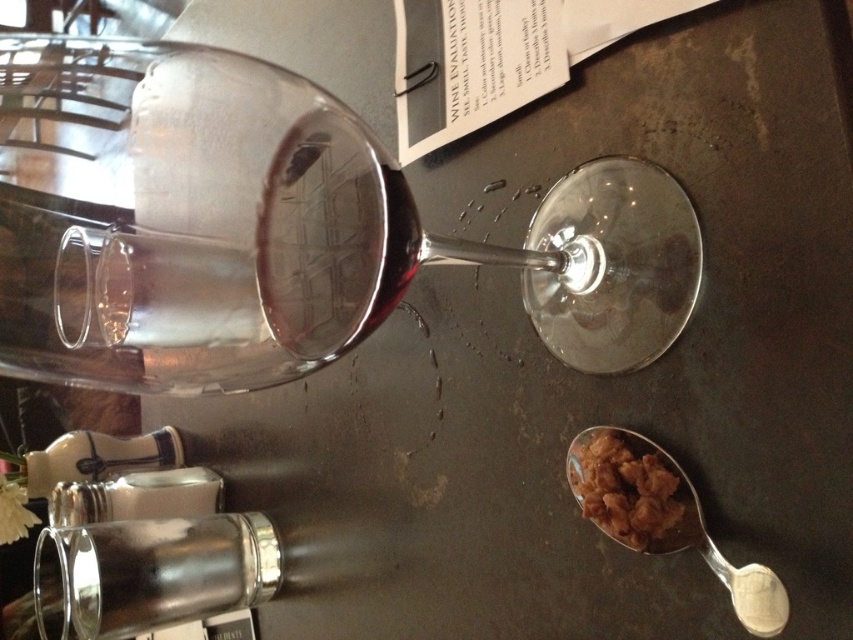
You are at a wine tasting event and see a table setup. There is a partially filled wine glass at the left side of the frame and a point marked at coordinates (x=276, y=228). Based on the table setup, where is the transparent glass located in relation to the point?

The point at (x=276, y=228) indicates the transparent glass is at the upper center, so the transparent glass is above and to the right of the point.

You are a bartender preparing a drink. You have a transparent glass at upper center and a silver metallic spoon at lower right. Which object is wider?

The transparent glass at upper center is wider than the silver metallic spoon at lower right according to the description.

You are at a wine tasting event and need to place a silver metallic spoon at lower right next to the silver metallic bottle at lower left. Can you do that without moving the wine glass?

The silver metallic bottle at lower left is positioned on the left side of the silver metallic spoon at lower right, so they are already next to each other. Therefore, you don not need to move the wine glass to place the spoon next to the bottle.